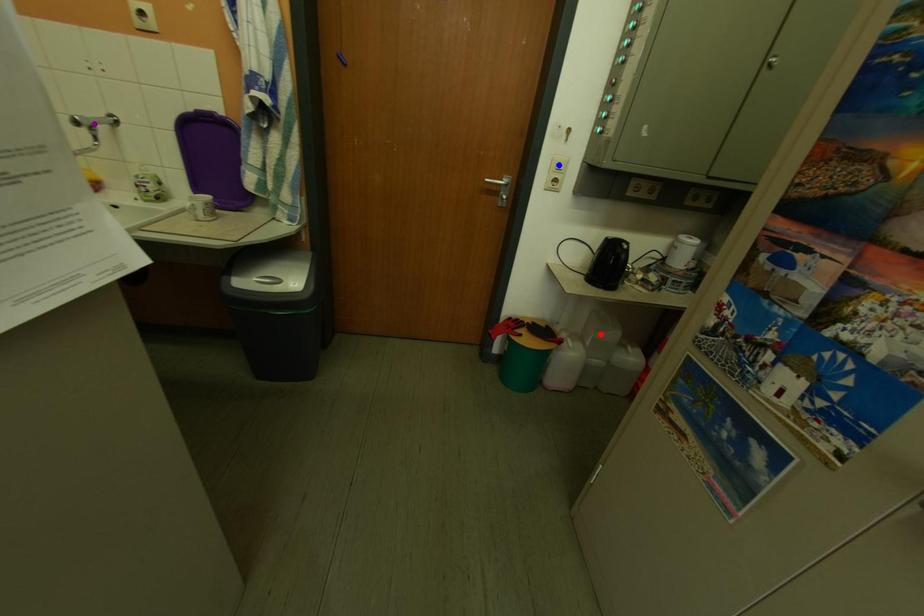
Order these from farthest to nearest:
red point, blue point, purple point

red point < blue point < purple point